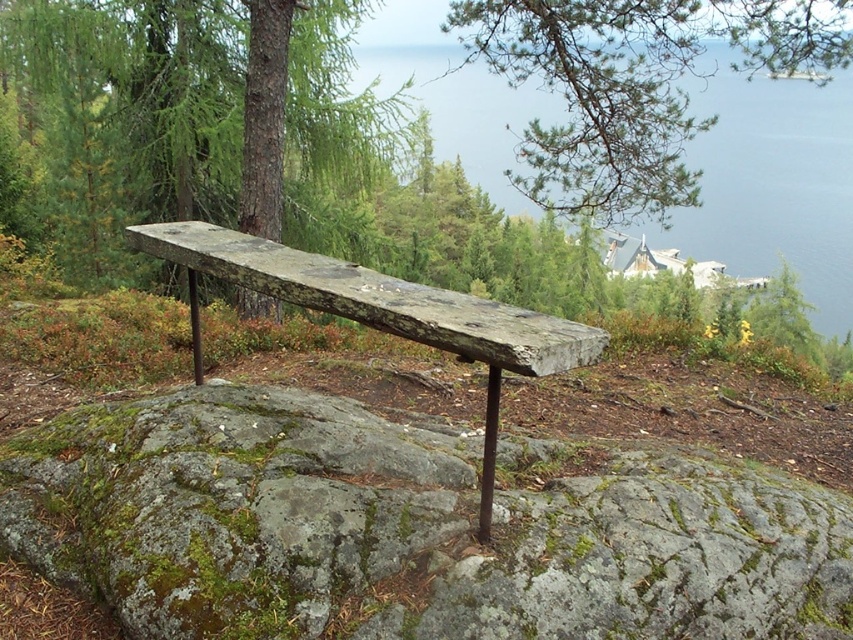
Can you confirm if green textured pine branch at upper center is positioned to the left of weathered wood bench at center?

No, green textured pine branch at upper center is not to the left of weathered wood bench at center.

Is green textured pine branch at upper center shorter than weathered wood bench at center?

Incorrect, green textured pine branch at upper center's height does not fall short of weathered wood bench at center's.

I want to click on green textured pine branch at upper center, so click(x=633, y=86).

Where is `green textured pine branch at upper center`? green textured pine branch at upper center is located at coordinates (633, 86).

Can you confirm if transparent blue water at upper center is positioned below weathered wood bench at center?

Incorrect, transparent blue water at upper center is not positioned below weathered wood bench at center.

Where is `transparent blue water at upper center`? transparent blue water at upper center is located at coordinates (770, 182).

Find the location of `transparent blue water at upper center`. transparent blue water at upper center is located at coordinates coord(770,182).

In the scene shown: Is green mossy rock at center to the left of green textured pine branch at upper center from the viewer's perspective?

Indeed, green mossy rock at center is positioned on the left side of green textured pine branch at upper center.

Which is more to the right, green mossy rock at center or green textured pine branch at upper center?

From the viewer's perspective, green textured pine branch at upper center appears more on the right side.

Between point (361, 413) and point (799, 54), which one is positioned in front?

Point (361, 413) is in front.

Where is `green mossy rock at center`? The width and height of the screenshot is (853, 640). green mossy rock at center is located at coordinates (405, 531).